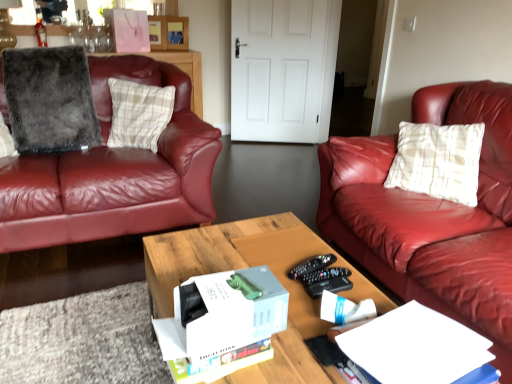
Question: Is white cardboard box at center wider or thinner than wooden coffee table at center?

Choices:
 (A) thin
 (B) wide

Answer: (A)

Question: Considering the relative positions of white cardboard box at center and wooden coffee table at center in the image provided, is white cardboard box at center to the left or to the right of wooden coffee table at center?

Choices:
 (A) left
 (B) right

Answer: (A)

Question: Which object is the farthest from the gray fluffy pillow at left, which is the first pillow from left to right?

Choices:
 (A) wooden coffee table at center
 (B) white paper at lower right
 (C) black plastic remote control at center
 (D) plaid fabric pillow at left, the first pillow viewed from the right
 (E) translucent glass bottle at upper left

Answer: (B)

Question: Estimate the real-world distances between objects in this image. Which object is farther from the white cardboard box at center?

Choices:
 (A) gray fluffy pillow at left, which is the first pillow from left to right
 (B) wooden coffee table at center
 (C) translucent glass bottle at upper left
 (D) white paper at lower right
 (E) plaid fabric pillow at left, the 2th pillow from the left

Answer: (C)